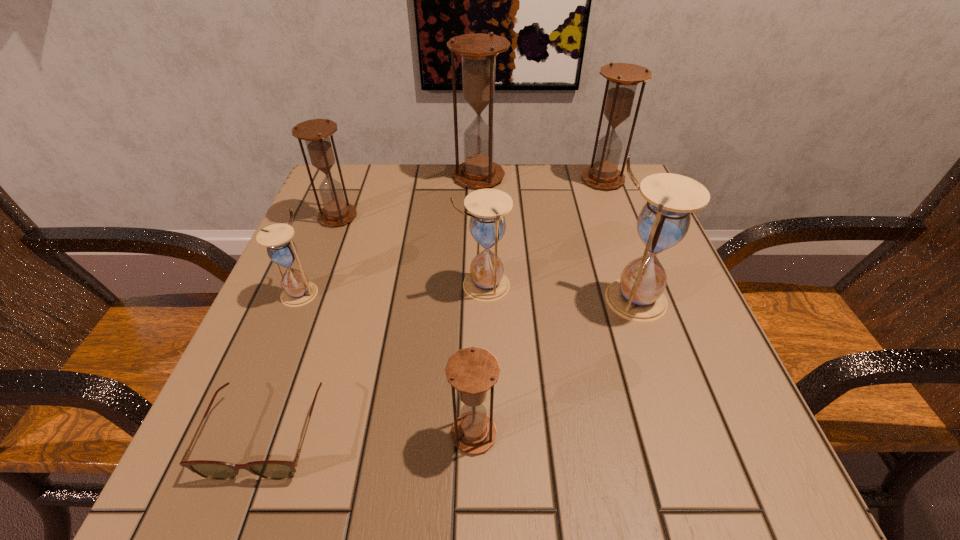
Identify which hourglass is the fifth closest to the biggest brown hourglass. Please provide its 2D coordinates. Your answer should be formatted as a tuple, i.e. [(x, y)], where the tuple contains the x and y coordinates of a point satisfying the conditions above.

[(297, 291)]

Where is `hourglass that can be found as the closest to the second smallest white hourglass`? Image resolution: width=960 pixels, height=540 pixels. hourglass that can be found as the closest to the second smallest white hourglass is located at coordinates (663, 222).

Locate an element on the screen. brown hourglass identified as the fourth closest to the leftmost white hourglass is located at coordinates (622, 78).

Select which brown hourglass appears as the third closest to the biggest brown hourglass. Please provide its 2D coordinates. Your answer should be formatted as a tuple, i.e. [(x, y)], where the tuple contains the x and y coordinates of a point satisfying the conditions above.

[(472, 371)]

Where is `the second closest white hourglass to the spectacles`? the second closest white hourglass to the spectacles is located at coordinates (486, 282).

Point out which white hourglass is positioned as the third nearest to the tallest hourglass. Please provide its 2D coordinates. Your answer should be formatted as a tuple, i.e. [(x, y)], where the tuple contains the x and y coordinates of a point satisfying the conditions above.

[(297, 291)]